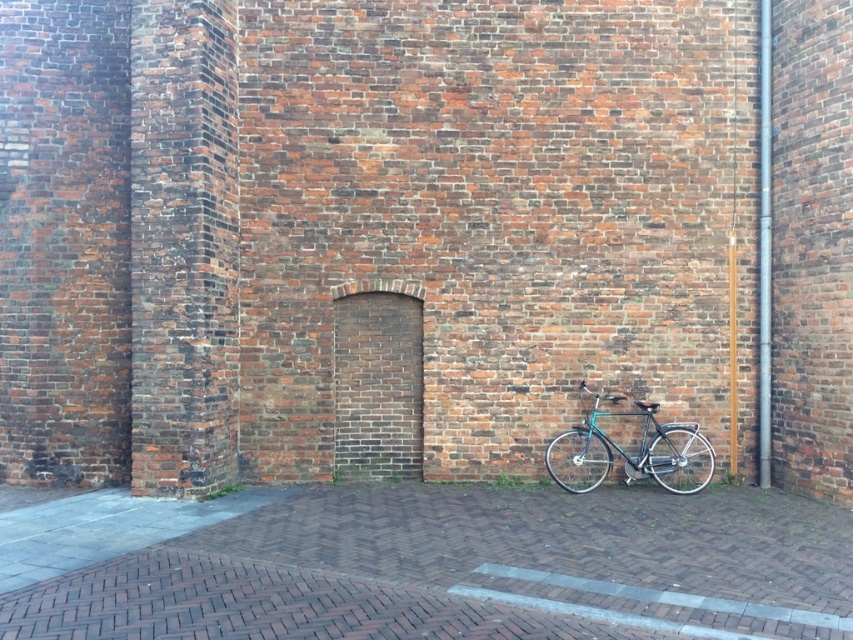
Question: Does brick pavement at lower right lie behind teal glossy bicycle at lower right?

Choices:
 (A) yes
 (B) no

Answer: (B)

Question: Is brick pavement at lower right bigger than metallic silver pole at right?

Choices:
 (A) yes
 (B) no

Answer: (A)

Question: Estimate the real-world distances between objects in this image. Which object is farther from the teal glossy bicycle at lower right?

Choices:
 (A) silver metallic pole at right
 (B) metallic silver pole at right
 (C) brick pavement at lower right

Answer: (C)

Question: Which point is farther to the camera?

Choices:
 (A) silver metallic pole at right
 (B) teal glossy bicycle at lower right
 (C) metallic silver pole at right
 (D) brick pavement at lower right

Answer: (C)

Question: Which object is closer to the camera taking this photo?

Choices:
 (A) brick pavement at lower right
 (B) silver metallic pole at right
 (C) teal glossy bicycle at lower right
 (D) metallic silver pole at right

Answer: (A)

Question: Is silver metallic pole at right smaller than metallic silver pole at right?

Choices:
 (A) yes
 (B) no

Answer: (B)